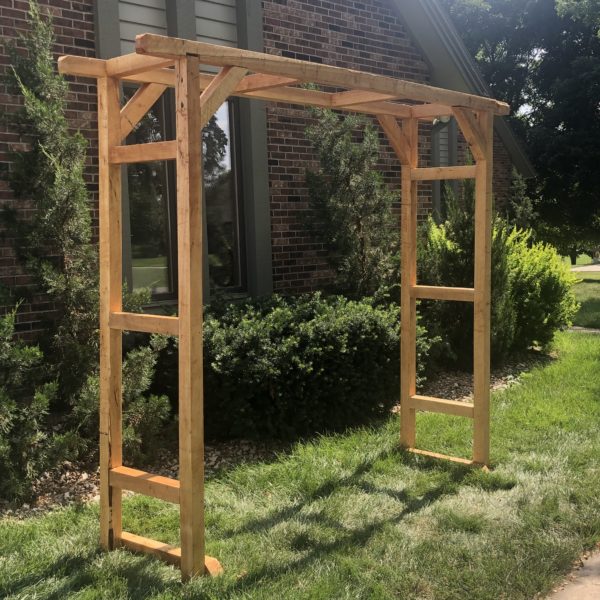
Where is `windows`? The width and height of the screenshot is (600, 600). windows is located at coordinates (212, 193), (141, 200).